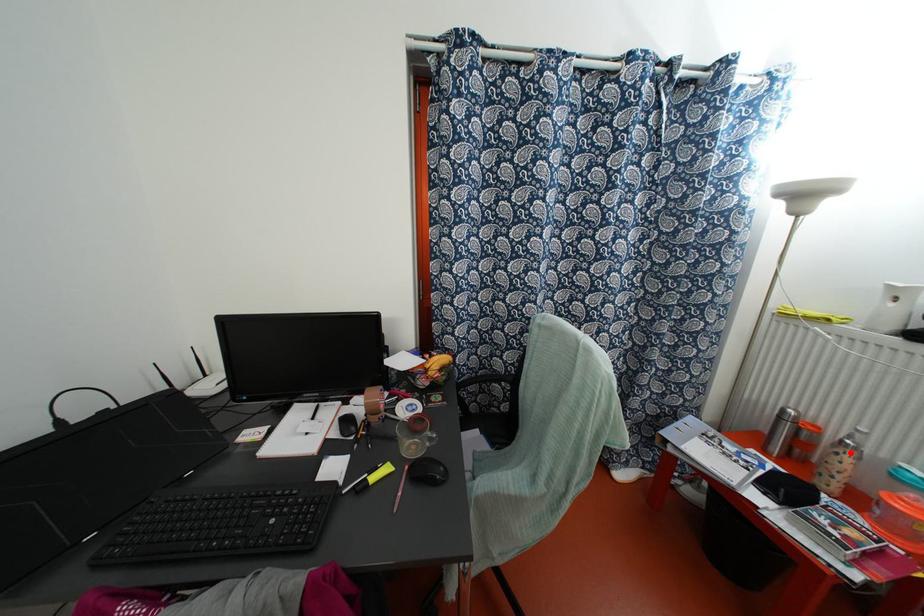
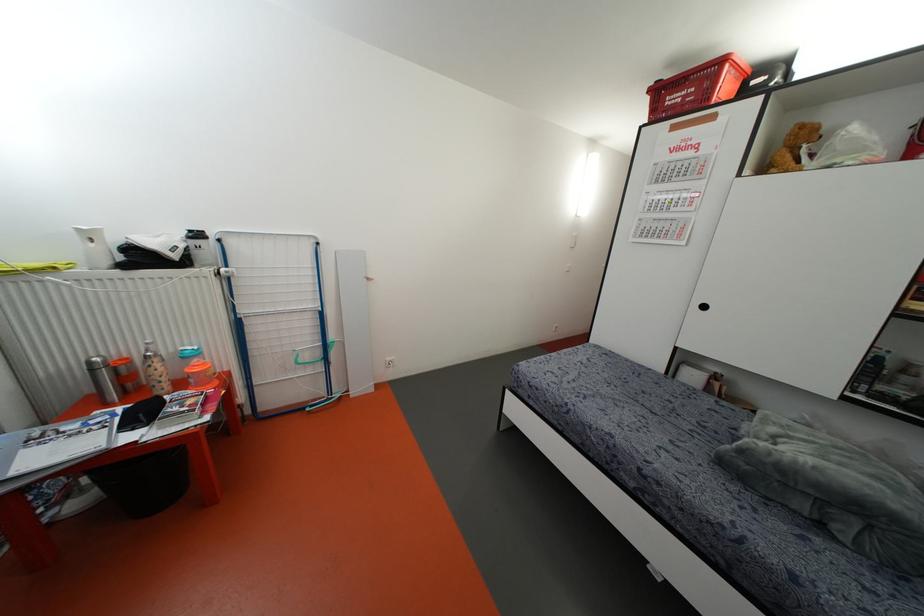
Find the pixel in the second image that matches the highlighted location in the first image.

(155, 360)